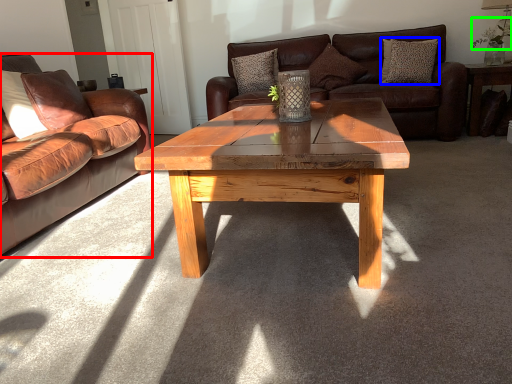
Question: Which object is positioned closest to studio couch (highlighted by a red box)? Select from pillow (highlighted by a blue box) and floral arrangement (highlighted by a green box).

Choices:
 (A) pillow
 (B) floral arrangement

Answer: (A)